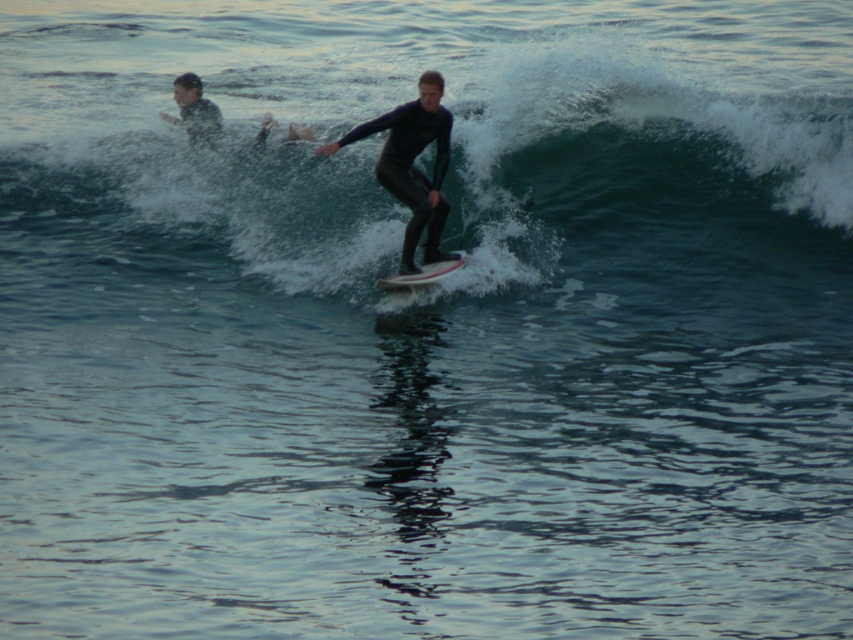
Between green rubber wave at upper center and white foam surfboard at center, which one appears on the right side from the viewer's perspective?

From the viewer's perspective, white foam surfboard at center appears more on the right side.

Is point (315, 259) more distant than point (460, 259)?

Yes, it is behind point (460, 259).

What are the coordinates of `green rubber wave at upper center` in the screenshot? It's located at (650, 188).

Is black matte surfboard at center wider than white foam surfboard at center?

Yes.

Find the location of a particular element. Image resolution: width=853 pixels, height=640 pixels. black matte surfboard at center is located at coordinates (412, 164).

Where is `black matte surfboard at center`? Image resolution: width=853 pixels, height=640 pixels. black matte surfboard at center is located at coordinates (412, 164).

Does green rubber wave at upper center have a smaller size compared to dark blue wetsuit surfer at upper left?

Actually, green rubber wave at upper center might be larger than dark blue wetsuit surfer at upper left.

Can you confirm if green rubber wave at upper center is positioned below dark blue wetsuit surfer at upper left?

Yes, green rubber wave at upper center is below dark blue wetsuit surfer at upper left.

Between point (821, 124) and point (193, 115), which one is positioned in front?

Point (821, 124) is more forward.

Where is `green rubber wave at upper center`? The width and height of the screenshot is (853, 640). green rubber wave at upper center is located at coordinates (650, 188).